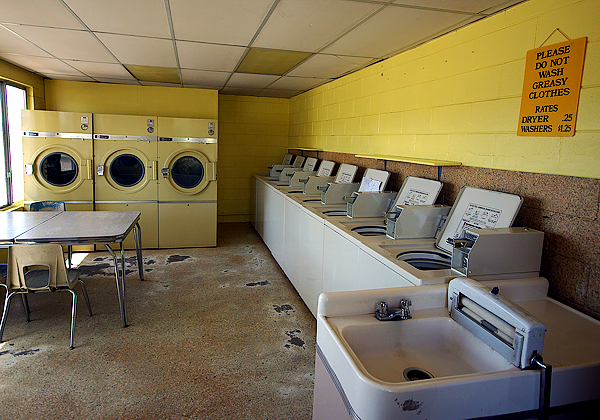
Where is `ceiling`? ceiling is located at coordinates (123, 21).